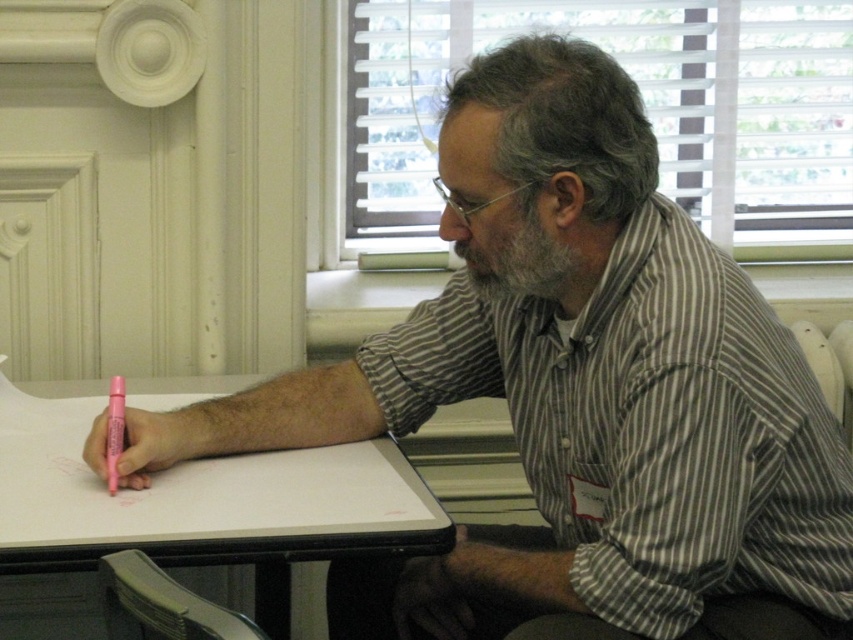
Based on the scene description, where is the striped cotton shirt at upper right positioned relative to the man and the table?

The striped cotton shirt at upper right is located at point coordinates (648,428), which places it near the upper right area of the scene, likely on the man or his clothing as he sits at the table.

You are a photographer standing in front of the scene. You want to take a photo of the striped cotton shirt at upper right and the pink plastic pen at lower left. Which object will appear larger in the photo?

The striped cotton shirt at upper right will appear larger in the photo because it is closer to the viewer than the pink plastic pen at lower left.